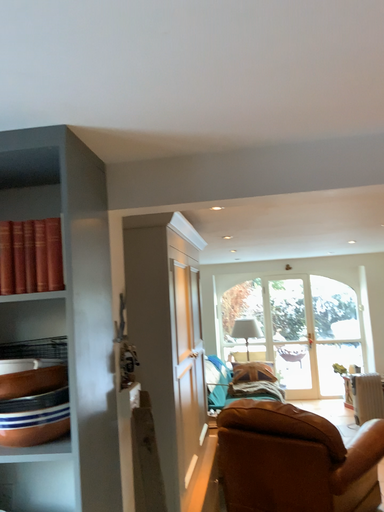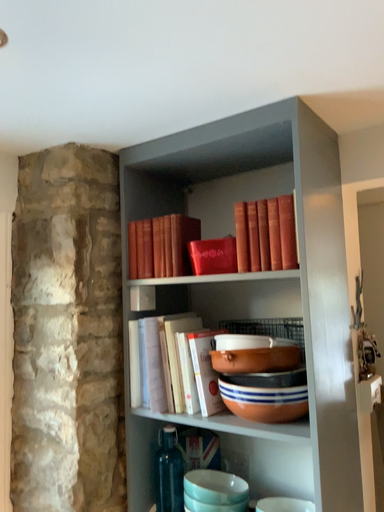
Question: How did the camera likely rotate when shooting the video?

Choices:
 (A) rotated right
 (B) rotated left

Answer: (B)